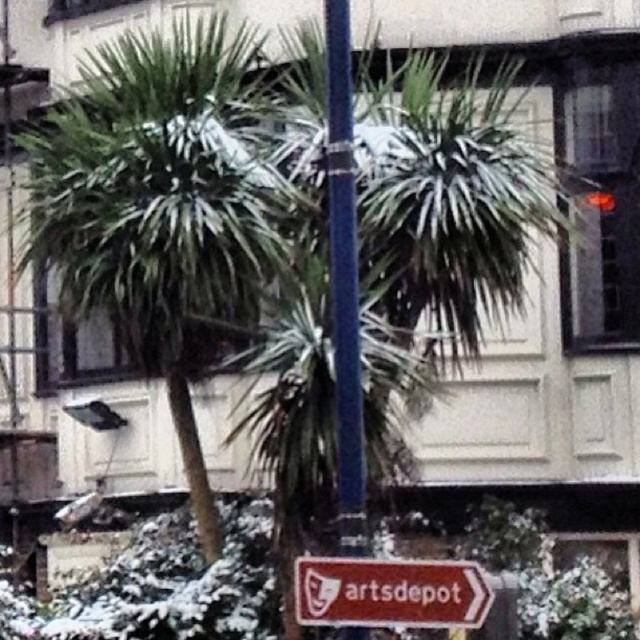
Question: Is green leafy palm tree at center positioned in front of smooth blue pole at center?

Choices:
 (A) yes
 (B) no

Answer: (B)

Question: Which object is positioned farthest from the smooth blue pole at center?

Choices:
 (A) green leafy palm tree at center
 (B) brown paper sign at lower center

Answer: (A)

Question: From the image, what is the correct spatial relationship of green leafy palm tree at center in relation to smooth blue pole at center?

Choices:
 (A) right
 (B) left

Answer: (B)

Question: Which point is farther to the camera?

Choices:
 (A) green leafy palm tree at center
 (B) smooth blue pole at center
 (C) brown paper sign at lower center

Answer: (A)

Question: Which of the following is the closest to the observer?

Choices:
 (A) (195, 26)
 (B) (332, 81)

Answer: (B)

Question: Can you confirm if green leafy palm tree at center is positioned to the right of brown paper sign at lower center?

Choices:
 (A) yes
 (B) no

Answer: (B)